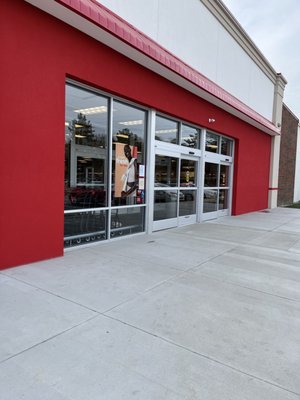
You are a GUI agent. You are given a task and a screenshot of the screen. Output one action in this format:
    pyautogui.click(x=<x>, y=<y>)
    Task: Click on the sliding glass door
    Image resolution: width=300 pixels, height=400 pixels.
    Given the screenshot: What is the action you would take?
    pyautogui.click(x=188, y=201)